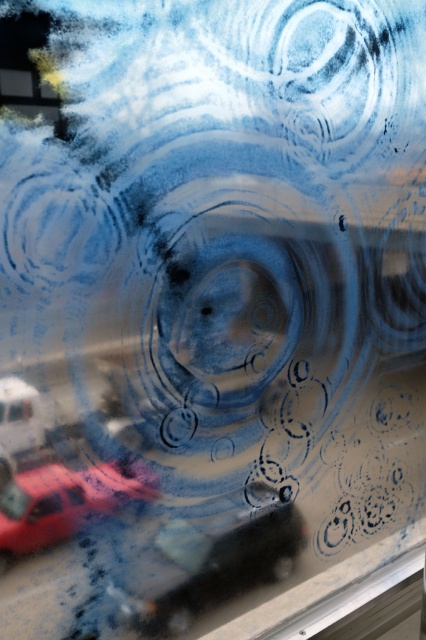
You are driving a delivery van and need to park between the shiny black car at center and the shiny red car at lower left. Can you fit your van there?

The shiny black car at center is positioned on the right side of the shiny red car at lower left, so there is space between them. However, the description does not provide the exact distance between the cars, so it is uncertain if the van can fit. Check the actual distance before deciding.

You are standing 5 feet away from a window with a shiny black car at center reflected on it. Can you lean closer to get a better look at the car without touching the window?

The shiny black car at center is 4.58 feet away from the viewer. Since you are already 5 feet away, leaning closer would bring you within the 4.58 feet distance, allowing you to get a better look without touching the window.

You are standing outside the window and see two points on the glass. The first point is at coordinate point (176, 624) and the second is at point (49, 470). Which point is closer to you?

Point (49, 470) is closer to you because it is in front of point (176, 624).